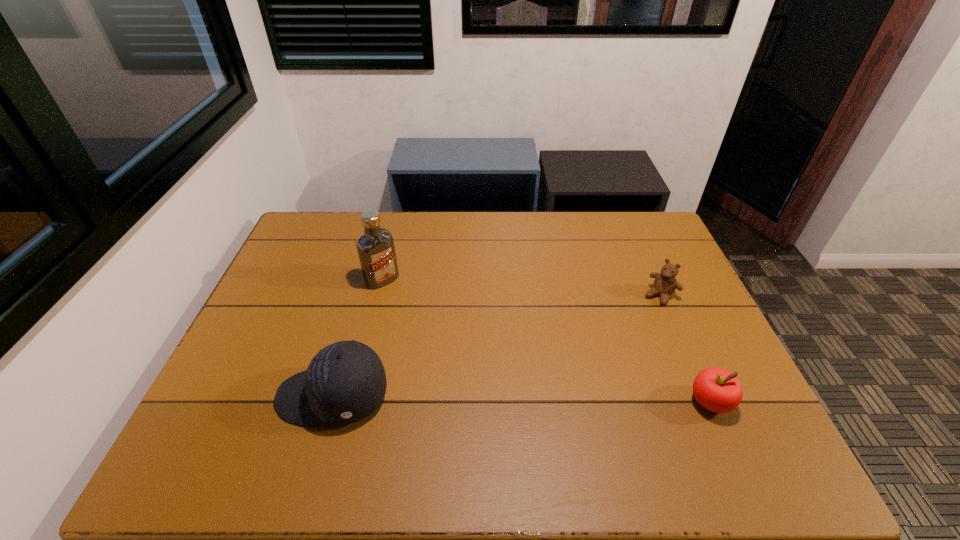
This screenshot has height=540, width=960. Find the location of `vacant space on the desktop that is between the baseball cap and the apple and is positioned on the front-facing side of the vodka`. vacant space on the desktop that is between the baseball cap and the apple and is positioned on the front-facing side of the vodka is located at coordinates (499, 399).

The image size is (960, 540). Identify the location of free space on the desktop that is between the third shortest object and the apple and is positioned on the front-facing side of the teddy bear. (575, 400).